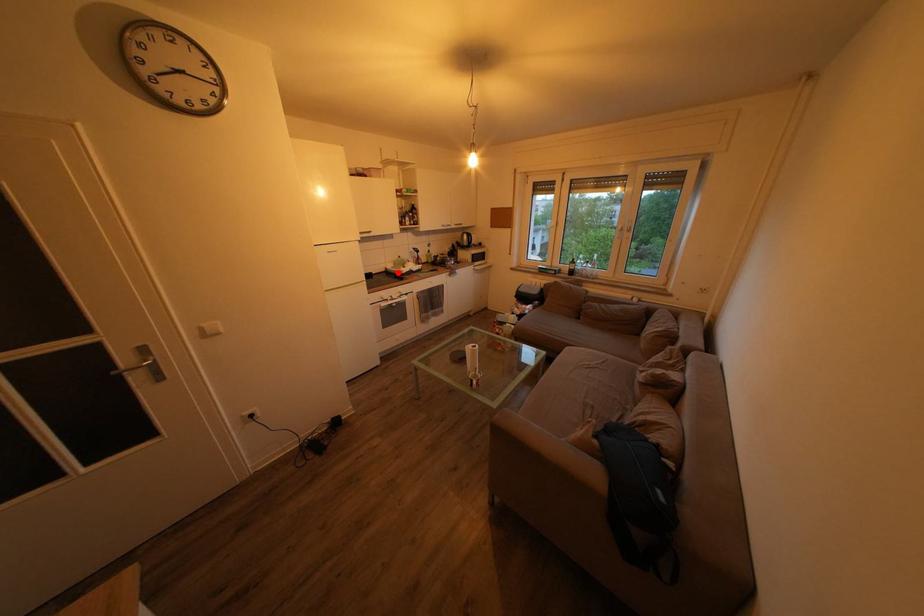
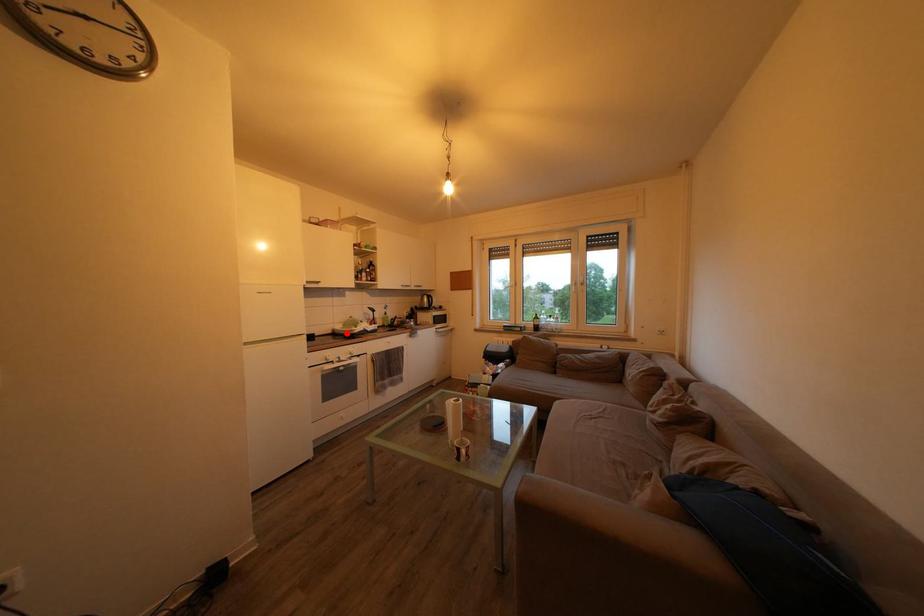
I am providing you with two images of the same scene from different viewpoints. A red point is marked on the first image and another point is marked on the second image. Are the points marked in image1 and image2 representing the same 3D position?

Yes